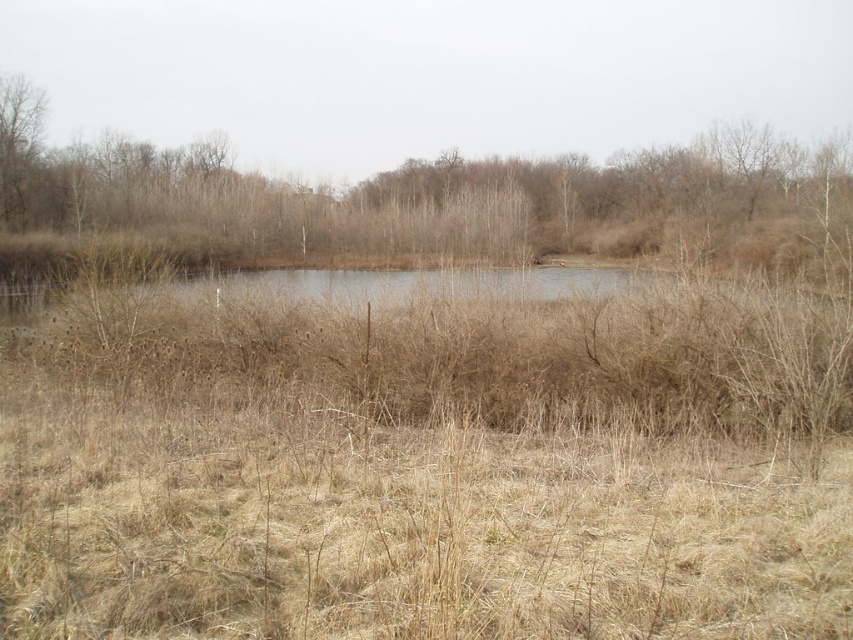
You are an environmental scientist analyzing this landscape. Based on the image, which object occupies a larger area in the scene? Please choose between the brown dry grass at center and the bare branches at left.

The brown dry grass at center occupies a larger area in the scene than the bare branches at left according to the description.

You are standing in the middle of the brown dry grass at center and want to walk towards the bare branches at left. Which direction should you face to move directly towards them?

You should face to the left because the brown dry grass at center is to the right of the bare branches at left.